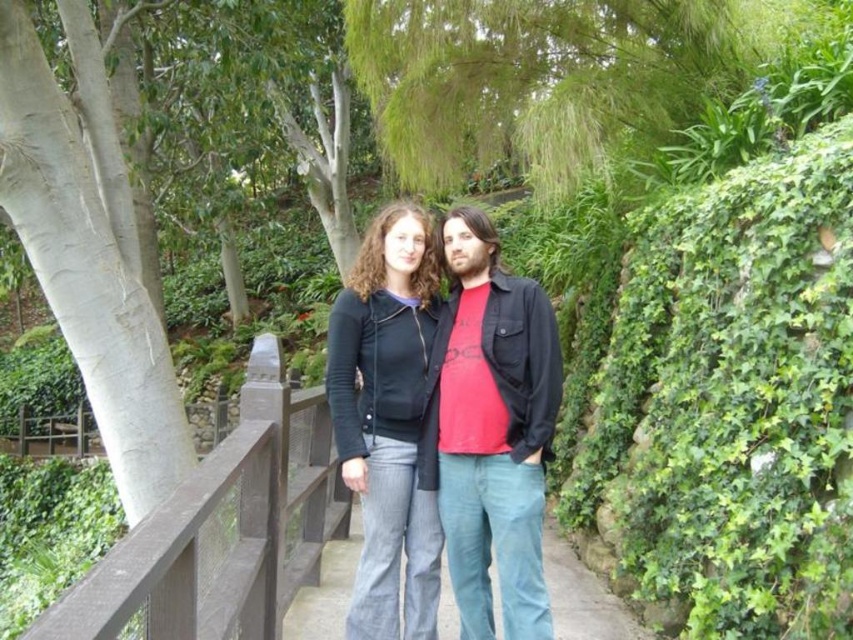
In the scene shown: You are a photographer trying to capture a photo of the brown wooden rail at center and the matte black jacket at center. From the perspective of the camera, which object is positioned to the right side?

The matte black jacket at center is positioned to the right of the brown wooden rail at center, so from the camera perspective, the matte black jacket at center is on the right side.